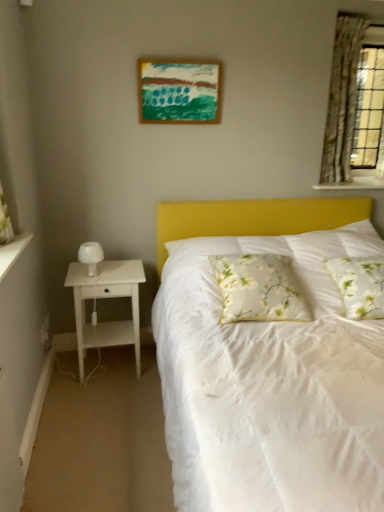
This screenshot has height=512, width=384. I want to click on blank space situated above green floral fabric curtain at upper right (from a real-world perspective), so click(x=363, y=12).